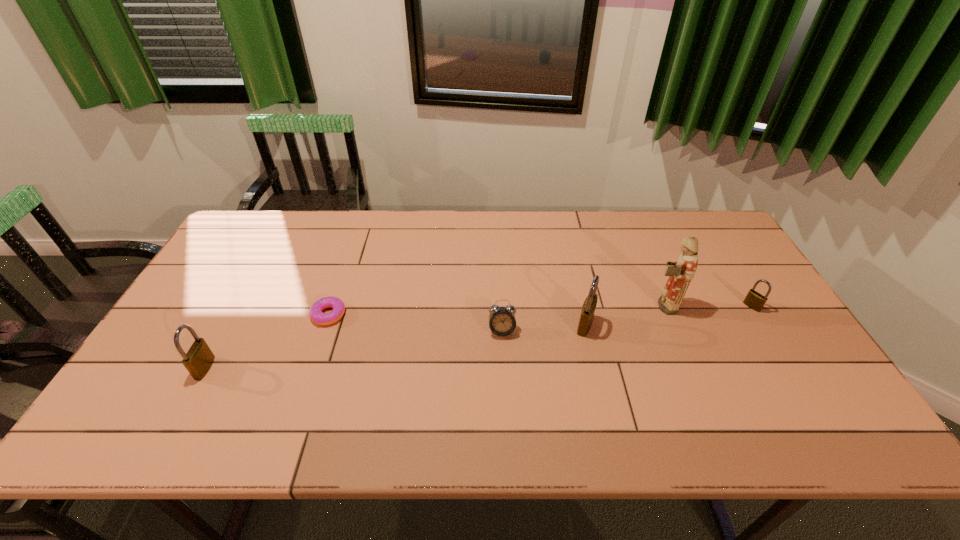
Locate an element on the screen. Image resolution: width=960 pixels, height=540 pixels. figurine is located at coordinates (681, 272).

Locate an element on the screen. This screenshot has width=960, height=540. vacant area situated 0.170m on the right of the leftmost padlock is located at coordinates (278, 368).

Image resolution: width=960 pixels, height=540 pixels. What are the coordinates of `vacant space located on the front of the second nearest padlock` in the screenshot? It's located at (603, 404).

This screenshot has width=960, height=540. Find the location of `vacant space located 0.220m on the front of the rightmost object`. vacant space located 0.220m on the front of the rightmost object is located at coordinates (796, 379).

Locate an element on the screen. This screenshot has height=540, width=960. vacant point located 0.210m on the back of the doughnut is located at coordinates (348, 255).

This screenshot has height=540, width=960. Identify the location of blank space located on the face of the alarm clock. [505, 389].

Image resolution: width=960 pixels, height=540 pixels. I want to click on free space located 0.130m on the front-facing side of the tallest object, so click(x=603, y=306).

Find the location of a particular element. free space located 0.230m on the front-facing side of the tallest object is located at coordinates (568, 306).

I want to click on vacant space located on the front-facing side of the tallest object, so click(593, 306).

Where is `object that is at the near edge`? The width and height of the screenshot is (960, 540). object that is at the near edge is located at coordinates pos(198,360).